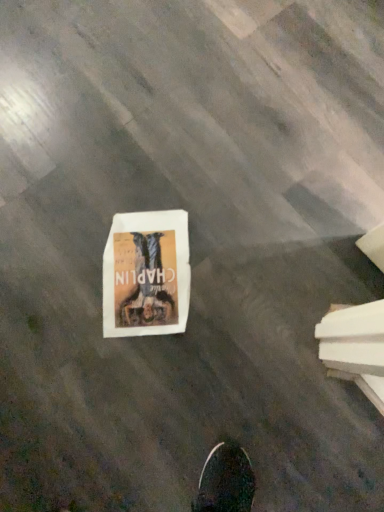
Identify the location of white paper comic book at center. This screenshot has height=512, width=384. (146, 274).

What do you see at coordinates (146, 274) in the screenshot?
I see `white paper comic book at center` at bounding box center [146, 274].

Where is `white paper comic book at center`? white paper comic book at center is located at coordinates (146, 274).